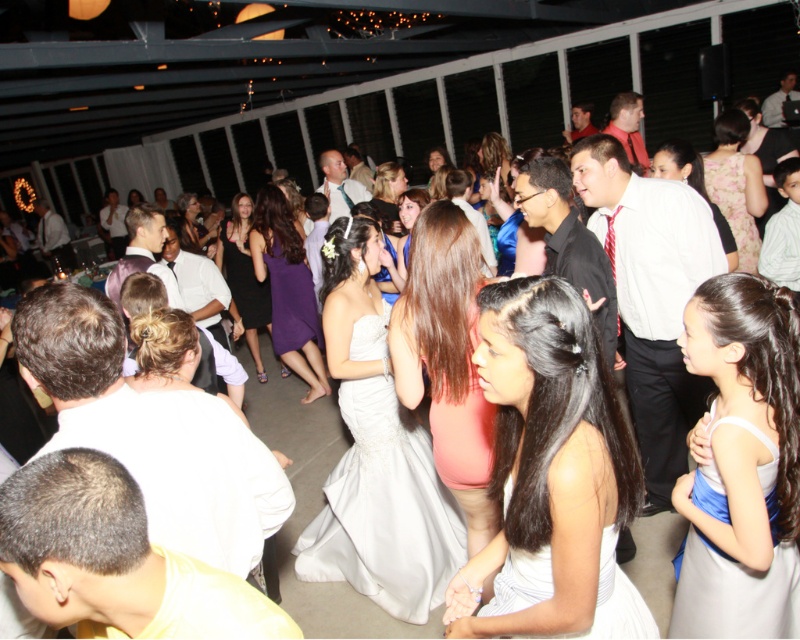
You are at the lively social gathering and want to take a photo of the point at coordinates (704,604). Your camera has a maximum focus range of 1.8 meters. Will the camera be able to focus on the point?

The distance of point (704,604) from the viewer is 1.73 meters, which is within the camera maximum focus range of 1.8 meters. So the camera can focus on the point.